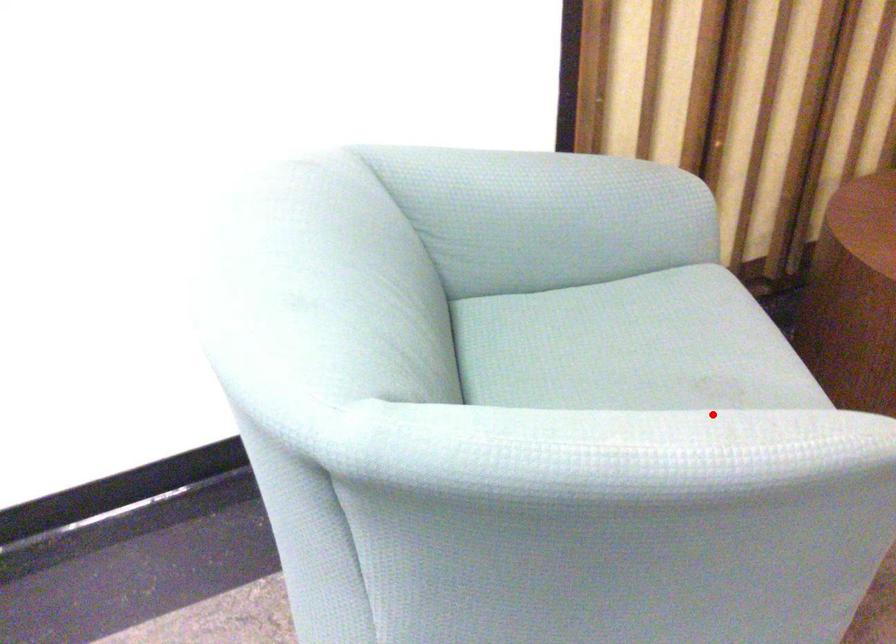
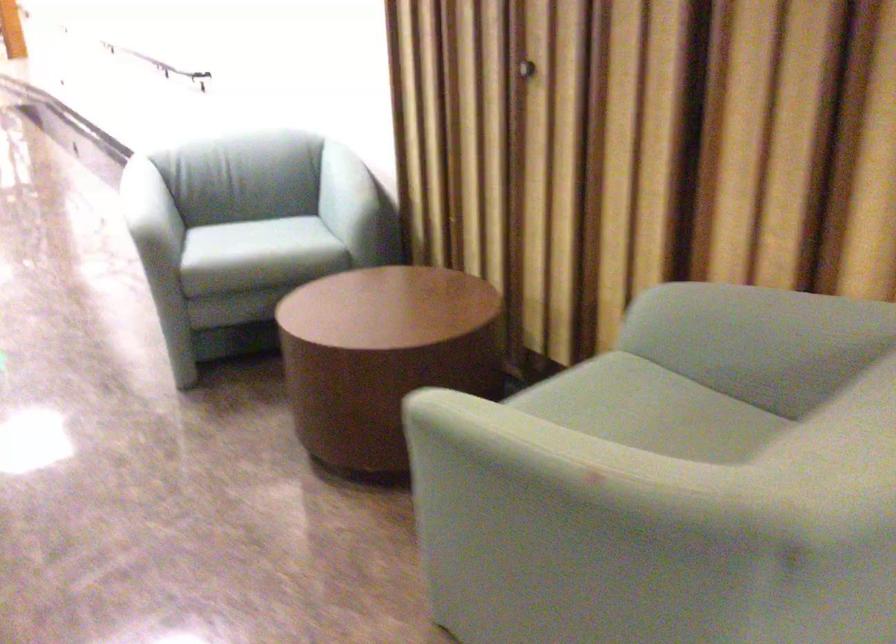
Locate, in the second image, the point that corresponds to the highlighted location in the first image.

(147, 196)